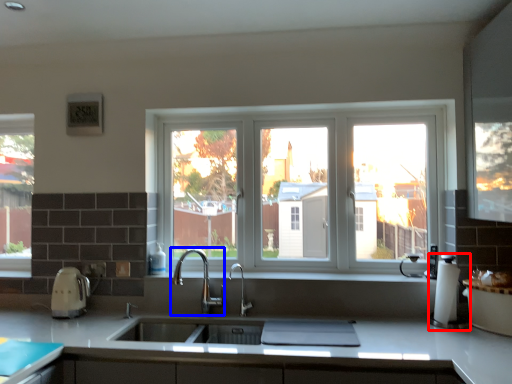
Question: Among these objects, which one is nearest to the camera, coffee machine (highlighted by a red box) or tap (highlighted by a blue box)?

Choices:
 (A) coffee machine
 (B) tap

Answer: (A)